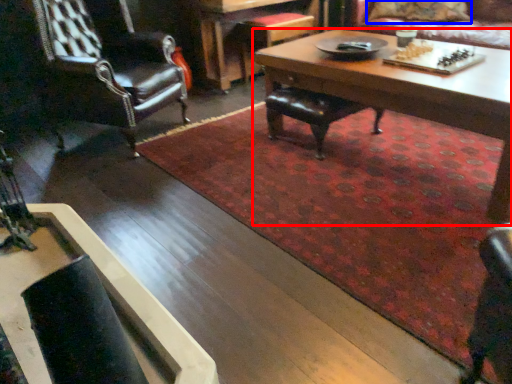
Question: Which object is further to the camera taking this photo, coffee table (highlighted by a red box) or pillow (highlighted by a blue box)?

Choices:
 (A) coffee table
 (B) pillow

Answer: (B)